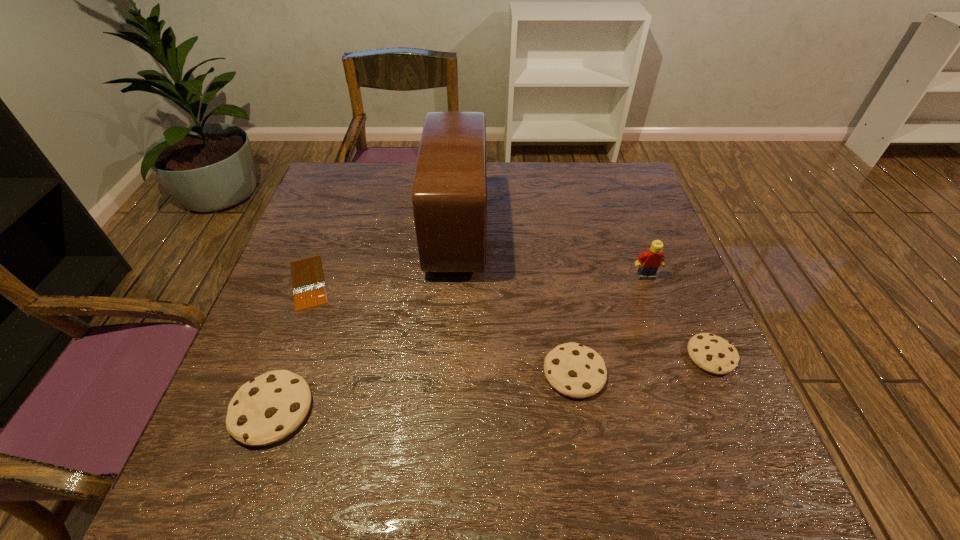
This screenshot has width=960, height=540. I want to click on Lego at the right edge, so click(x=649, y=262).

The height and width of the screenshot is (540, 960). I want to click on object situated at the near left corner, so click(268, 408).

The image size is (960, 540). Find the location of `vacant space at the far edge`. vacant space at the far edge is located at coordinates (542, 208).

Locate an element on the screen. The image size is (960, 540). blank space at the left edge of the desktop is located at coordinates (326, 224).

This screenshot has width=960, height=540. Identify the location of vacant space at the right edge of the desktop. (621, 233).

Where is `vacant area at the far left corner`? This screenshot has width=960, height=540. vacant area at the far left corner is located at coordinates (334, 199).

Locate an element on the screen. This screenshot has width=960, height=540. free space between the tallest object and the shortest object is located at coordinates (383, 256).

Locate an element on the screen. The image size is (960, 540). vacant region between the second shortest cookie and the shortest object is located at coordinates (442, 327).

Locate an element on the screen. This screenshot has height=540, width=960. free point between the third tallest object and the fifth shortest object is located at coordinates (459, 343).

The image size is (960, 540). I want to click on blank region between the Lego and the shortest object, so click(477, 279).